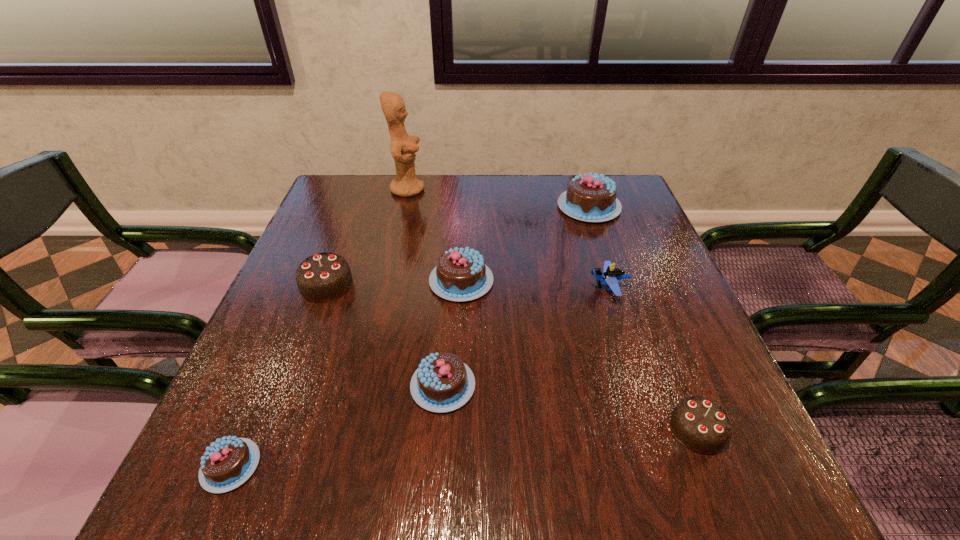
Locate an element on the screen. This screenshot has height=540, width=960. the smaller chocolate chocolate cake is located at coordinates (700, 424).

Identify the location of the shortest object. (226, 464).

This screenshot has width=960, height=540. I want to click on the nearest pink chocolate cake, so click(226, 464).

The height and width of the screenshot is (540, 960). I want to click on vacant position located 0.300m on the front-facing side of the figurine, so click(x=524, y=189).

You are a GUI agent. You are given a task and a screenshot of the screen. Output one action in this format:
    pyautogui.click(x=<x>, y=<y>)
    Task: Click on the vacant area situated 0.290m on the left of the biggest pink chocolate cake
    
    Given the screenshot: What is the action you would take?
    [456, 207]

The image size is (960, 540). Identify the location of vacant space located on the back of the left chocolate chocolate cake. (355, 208).

At what (x,y) coordinates should I click in order to perform the action: click on blank space located 0.310m on the left of the second biggest pink chocolate cake. Please return your answer as a coordinate pair (x, y). Looking at the image, I should click on (296, 281).

You are a GUI agent. You are given a task and a screenshot of the screen. Output one action in this format:
    pyautogui.click(x=<x>, y=<y>)
    Task: Click on the vacant space located on the front-facing side of the Lego
    Image resolution: width=960 pixels, height=540 pixels.
    Given the screenshot: What is the action you would take?
    pyautogui.click(x=563, y=288)

The height and width of the screenshot is (540, 960). I want to click on free spot located 0.190m on the front-facing side of the Lego, so click(x=506, y=288).

The height and width of the screenshot is (540, 960). Identify the location of free point located 0.290m on the front-facing side of the Lego. (462, 288).